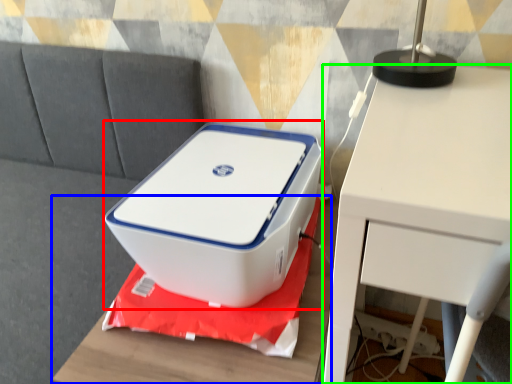
Question: Which object is the farthest from storage box (highlighted by a red box)? Choose among these: furniture (highlighted by a blue box) or table (highlighted by a green box).

Choices:
 (A) furniture
 (B) table

Answer: (B)